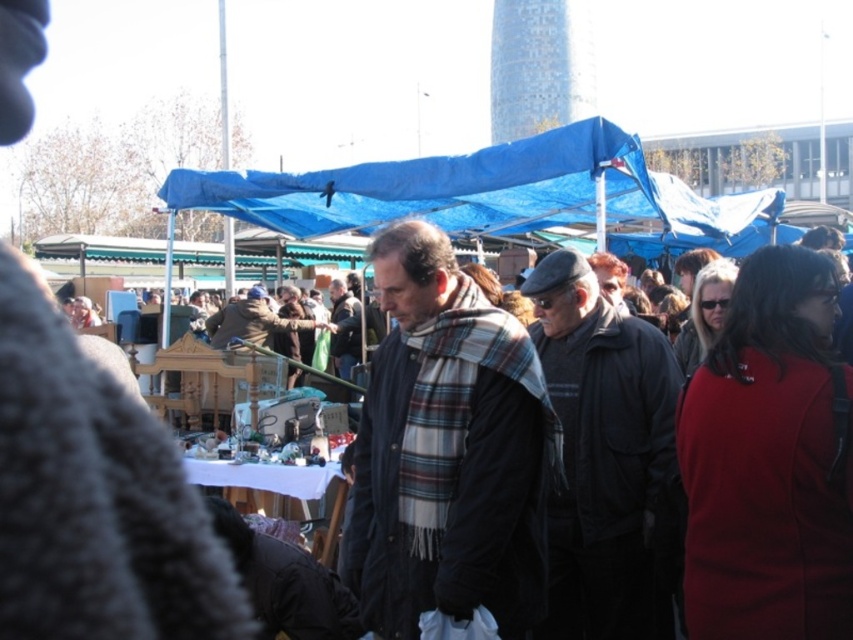
You are standing at the entrance of the market and want to find the dark gray woolen jacket at center. According to the coordinates provided, where should you look relative to the image center?

The dark gray woolen jacket at center is located at point coordinates approximately 0.711 on the x and 0.708 on the y, which places it to the right and slightly below the image center.

What is located at the point with coordinates (448, 451) in the image?

The plaid scarf at center is located at point (448, 451).